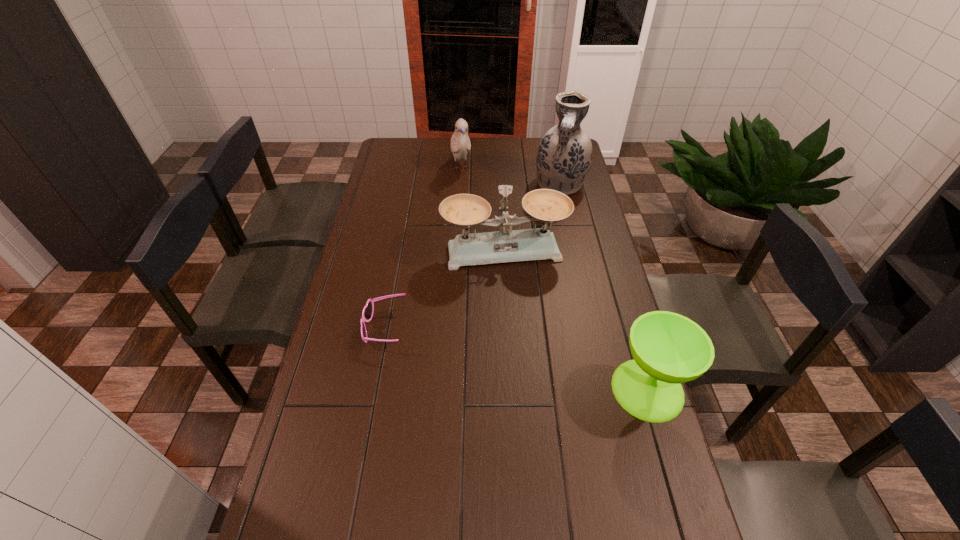
You are a GUI agent. You are given a task and a screenshot of the screen. Output one action in this format:
    pyautogui.click(x=<x>, y=<y>)
    Task: Click on the empty space between the leftmost object and the scale
    The width and height of the screenshot is (960, 540).
    Given the screenshot: What is the action you would take?
    pyautogui.click(x=444, y=290)

This screenshot has height=540, width=960. What are the coordinates of `free space between the fourth farthest object and the nearest object` in the screenshot? It's located at (516, 359).

This screenshot has height=540, width=960. I want to click on unoccupied position between the bird and the fourth farthest object, so click(423, 248).

Identify the location of vacant area that lies between the tallest object and the nearest object. The width and height of the screenshot is (960, 540). (604, 287).

The width and height of the screenshot is (960, 540). I want to click on the fourth closest object to the bird, so click(668, 349).

Where is `object that is the second closest one to the nearest object`? object that is the second closest one to the nearest object is located at coordinates (367, 313).

This screenshot has width=960, height=540. Find the location of `vacant region that satisfies the following two spatial constraints: 1. on the front side of the fourth tallest object; 2. on the right side of the third farthest object`. vacant region that satisfies the following two spatial constraints: 1. on the front side of the fourth tallest object; 2. on the right side of the third farthest object is located at coordinates (513, 389).